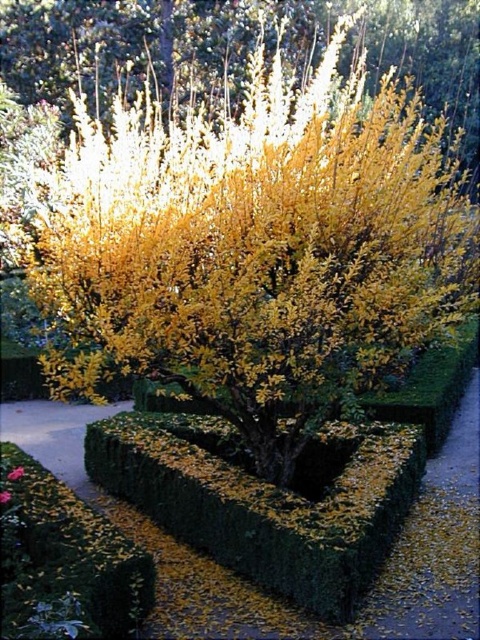
You are standing in the garden and want to reach the point marked at coordinates [257,528]. Given that the distance from your current position to this point is 14.72 feet, can you estimate how far you need to walk to reach it?

The point marked at coordinates [257,528] is 14.72 feet away from the camera, so you need to walk approximately 14.72 feet to reach it.

You are a gardener planning to place a decorative statue between the green hedge at center and the vivid pink petals at center. Since the statue requires a space proportional to the size of the objects, which object should the statue be placed closer to?

The green hedge at center is bigger than the vivid pink petals at center, so the statue should be placed closer to the green hedge at center to match its larger size.

You are standing in the garden and want to pick the vivid pink petals at center. Which direction should you move relative to the green hedge at center?

The green hedge at center is to the right of the vivid pink petals at center, so you should move to the left relative to the green hedge at center to reach the vivid pink petals at center.